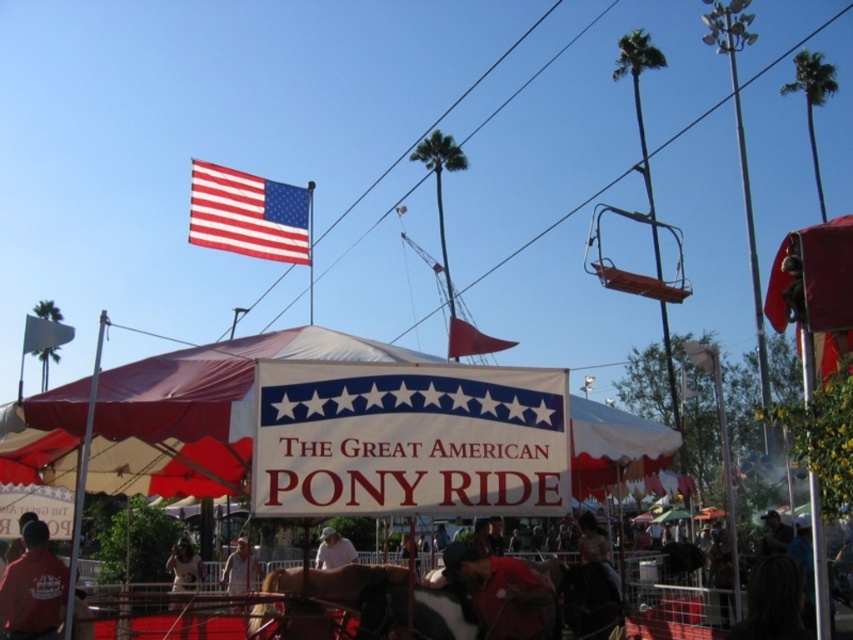
Looking at this image, you are a visitor at the carnival and want to take a photo of the brown glossy horse at center and the matte red shirt at lower left. Which object should you focus on first if you want to capture both in the same frame without moving the camera?

The brown glossy horse at center is not as tall as the matte red shirt at lower left, so you should focus on the matte red shirt at lower left first to ensure both are in the frame.

You are a photographer at the carnival and want to capture both the matte red shirt at lower left and the light brown leather jacket at center in a single frame. Which person should you focus on first to ensure both are in the frame?

You should focus on the matte red shirt at lower left first because it is wider than the light brown leather jacket at center, allowing you to adjust the frame to include both.